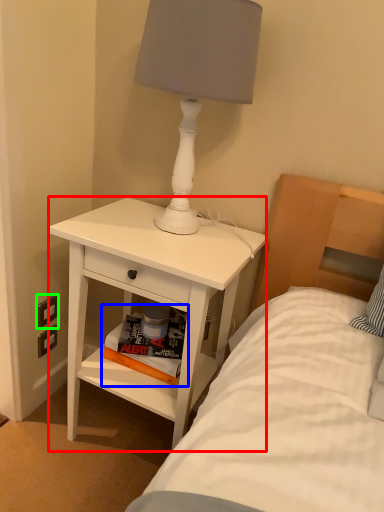
Question: Which is nearer to the nightstand (highlighted by a red box)? magazine (highlighted by a blue box) or electric outlet (highlighted by a green box).

Choices:
 (A) magazine
 (B) electric outlet

Answer: (A)